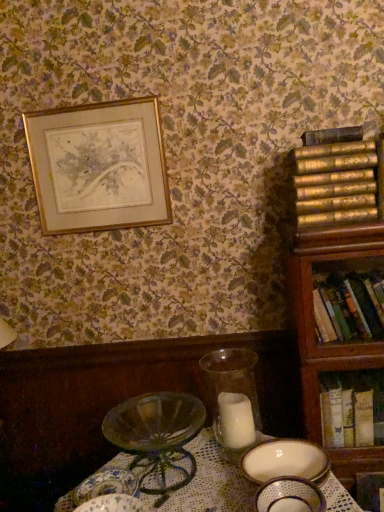
Question: From a real-world perspective, is gold textured books at right, which appears as the 1th book when viewed from the top, positioned under porcelain bowl at lower center, the first tableware when ordered from front to back, based on gravity?

Choices:
 (A) no
 (B) yes

Answer: (A)

Question: Considering the relative positions of gold textured books at right, which appears as the 1th book when viewed from the top, and porcelain bowl at lower center, which is the second tableware from left to right, in the image provided, is gold textured books at right, which appears as the 1th book when viewed from the top, behind porcelain bowl at lower center, which is the second tableware from left to right,?

Choices:
 (A) yes
 (B) no

Answer: (A)

Question: Is gold textured books at right, the 3th book ordered from the bottom, taller than porcelain bowl at lower center, the 1th tableware positioned from the right?

Choices:
 (A) yes
 (B) no

Answer: (A)

Question: Is gold textured books at right, which appears as the 1th book when viewed from the top, next to porcelain bowl at lower center, the 1th tableware positioned from the right, and touching it?

Choices:
 (A) no
 (B) yes

Answer: (A)

Question: Is gold textured books at right, which appears as the 1th book when viewed from the top, to the right of porcelain bowl at lower center, the 1th tableware positioned from the right, from the viewer's perspective?

Choices:
 (A) yes
 (B) no

Answer: (A)

Question: From a real-world perspective, is white paper book at right, the 3th book viewed from the top, positioned above or below gold textured books at right, the 3th book ordered from the bottom?

Choices:
 (A) below
 (B) above

Answer: (A)

Question: From the image's perspective, relative to gold textured books at right, the 3th book ordered from the bottom, is white paper book at right, the 3th book viewed from the top, above or below?

Choices:
 (A) above
 (B) below

Answer: (B)

Question: Considering their positions, is white paper book at right, which is the first book from bottom to top, located in front of or behind gold textured books at right, the 3th book ordered from the bottom?

Choices:
 (A) behind
 (B) front

Answer: (A)

Question: In the image, is white paper book at right, which is the first book from bottom to top, on the left side or the right side of gold textured books at right, which appears as the 1th book when viewed from the top?

Choices:
 (A) left
 (B) right

Answer: (B)

Question: From the image's perspective, relative to hardcover book at right, the 2th book positioned from the bottom, is gold textured books at right, which appears as the 1th book when viewed from the top, above or below?

Choices:
 (A) above
 (B) below

Answer: (A)

Question: In terms of width, does gold textured books at right, the 3th book ordered from the bottom, look wider or thinner when compared to hardcover book at right, the 2th book positioned from the bottom?

Choices:
 (A) thin
 (B) wide

Answer: (B)

Question: Is gold textured books at right, the 3th book ordered from the bottom, situated inside hardcover book at right, arranged as the 2th book when viewed from the top, or outside?

Choices:
 (A) outside
 (B) inside

Answer: (A)

Question: From a real-world perspective, is gold textured books at right, the 3th book ordered from the bottom, physically located above or below hardcover book at right, arranged as the 2th book when viewed from the top?

Choices:
 (A) above
 (B) below

Answer: (A)

Question: From the image's perspective, relative to translucent glass candle at center, is porcelain plate at lower center, which is the 2th tableware from front to back, above or below?

Choices:
 (A) below
 (B) above

Answer: (A)

Question: Considering the positions of porcelain plate at lower center, which ranks as the first tableware in left-to-right order, and translucent glass candle at center in the image, is porcelain plate at lower center, which ranks as the first tableware in left-to-right order, bigger or smaller than translucent glass candle at center?

Choices:
 (A) big
 (B) small

Answer: (B)